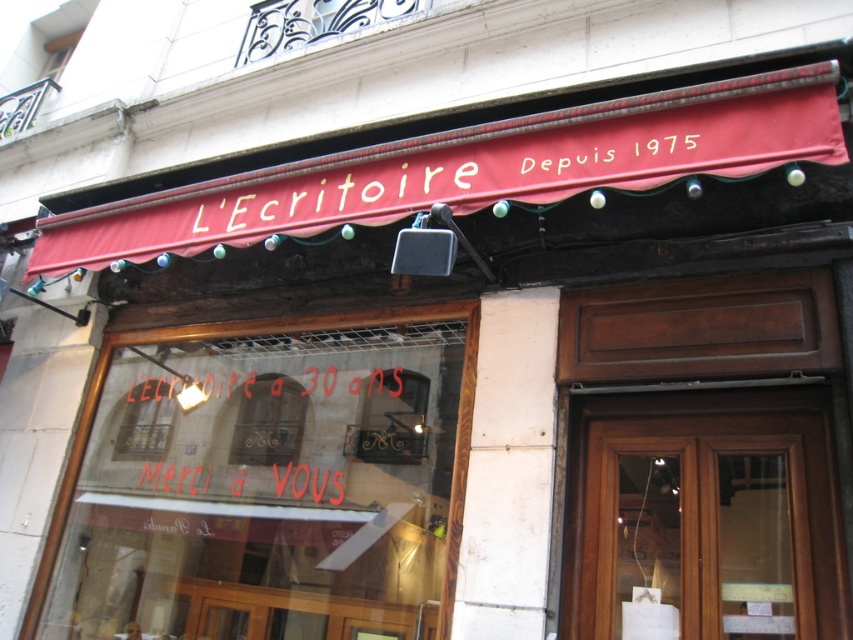
Is brown wooden door at center closer to the viewer compared to gold text sign at upper center?

That is True.

Between brown wooden door at center and gold text sign at upper center, which one appears on the right side from the viewer's perspective?

brown wooden door at center

Which is behind, point (670, 422) or point (670, 115)?

Positioned behind is point (670, 422).

The width and height of the screenshot is (853, 640). In order to click on brown wooden door at center in this screenshot , I will do `click(705, 516)`.

Can you confirm if brown wooden door at center is shorter than red painted text at center?

Incorrect, brown wooden door at center's height does not fall short of red painted text at center's.

Does point (779, 400) lie in front of point (204, 445)?

That is True.

Is point (721, 589) more distant than point (378, 496)?

No.

The height and width of the screenshot is (640, 853). Find the location of `brown wooden door at center`. brown wooden door at center is located at coordinates (705, 516).

Which is behind, point (165, 442) or point (677, 132)?

The point (165, 442) is more distant.

Which is behind, point (344, 394) or point (569, 138)?

The point (344, 394) is more distant.

Identify the location of red painted text at center. The height and width of the screenshot is (640, 853). (274, 436).